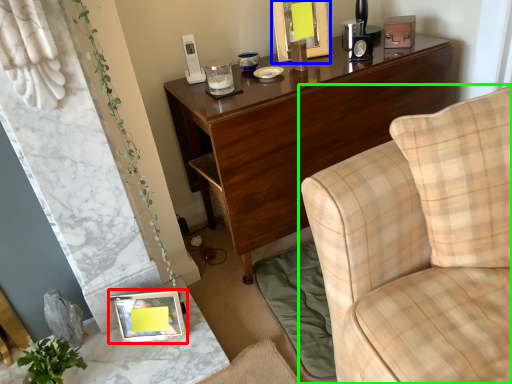
Question: Based on their relative distances, which object is farther from picture frame (highlighted by a red box)? Choose from picture frame (highlighted by a blue box) and studio couch (highlighted by a green box).

Choices:
 (A) picture frame
 (B) studio couch

Answer: (A)